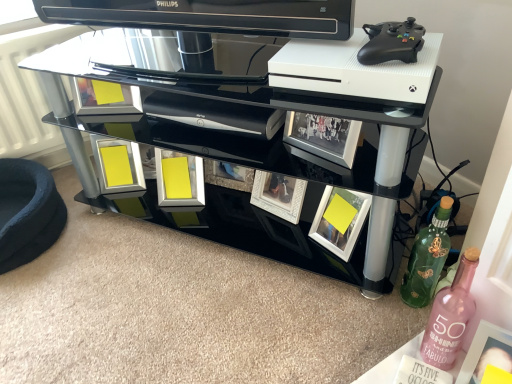
Identify the location of free space between black glass tv stand at center and white glossy magazine at lower right. The height and width of the screenshot is (384, 512). [271, 293].